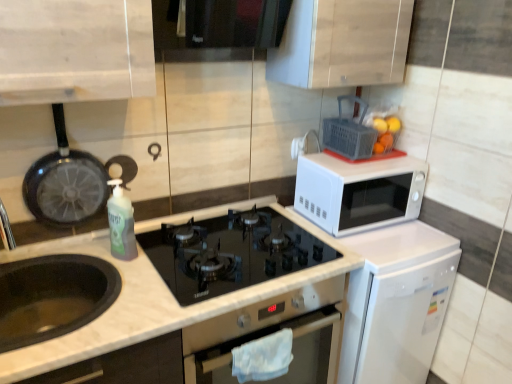
Question: From a real-world perspective, is white matte microwave at upper right under black matte sink at lower left?

Choices:
 (A) no
 (B) yes

Answer: (A)

Question: Does white matte microwave at upper right come in front of black matte sink at lower left?

Choices:
 (A) yes
 (B) no

Answer: (B)

Question: Is white matte microwave at upper right turned away from black matte sink at lower left?

Choices:
 (A) no
 (B) yes

Answer: (A)

Question: Is white matte microwave at upper right at the right side of black matte sink at lower left?

Choices:
 (A) no
 (B) yes

Answer: (B)

Question: From the image's perspective, would you say white matte microwave at upper right is positioned over black matte sink at lower left?

Choices:
 (A) yes
 (B) no

Answer: (A)

Question: Considering the relative sizes of white matte microwave at upper right and black matte sink at lower left in the image provided, is white matte microwave at upper right bigger than black matte sink at lower left?

Choices:
 (A) no
 (B) yes

Answer: (B)

Question: Is translucent plastic bottle at center-left looking in the opposite direction of black matte frying pan at left?

Choices:
 (A) no
 (B) yes

Answer: (B)

Question: Considering the relative sizes of translucent plastic bottle at center-left and black matte frying pan at left in the image provided, is translucent plastic bottle at center-left thinner than black matte frying pan at left?

Choices:
 (A) yes
 (B) no

Answer: (B)

Question: Is black matte frying pan at left inside translucent plastic bottle at center-left?

Choices:
 (A) yes
 (B) no

Answer: (B)

Question: Does translucent plastic bottle at center-left have a greater width compared to black matte frying pan at left?

Choices:
 (A) no
 (B) yes

Answer: (B)

Question: Does translucent plastic bottle at center-left have a larger size compared to black matte frying pan at left?

Choices:
 (A) no
 (B) yes

Answer: (A)

Question: Is translucent plastic bottle at center-left in contact with black matte frying pan at left?

Choices:
 (A) no
 (B) yes

Answer: (A)

Question: Can you confirm if metallic silver oven at center is shorter than black glass gas stove at center?

Choices:
 (A) no
 (B) yes

Answer: (A)